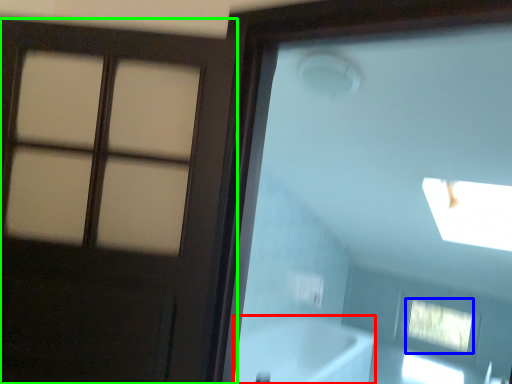
Question: Estimate the real-world distances between objects in this image. Which object is closer to bath (highlighted by a red box), window (highlighted by a blue box) or door (highlighted by a green box)?

Choices:
 (A) window
 (B) door

Answer: (A)